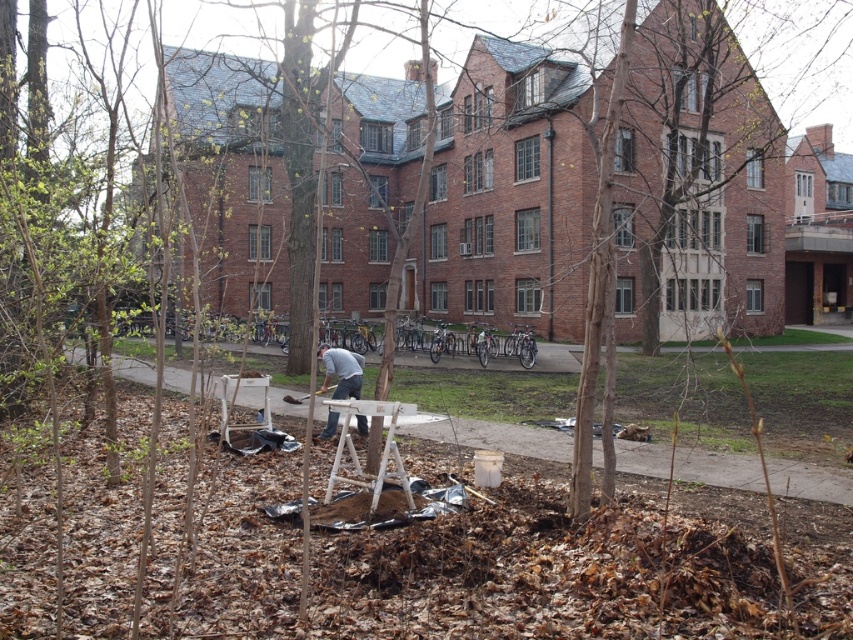
You are an artist who wants to set up your canvas on the white wood easel at center. However, there is a gray fabric at center in the way. Can you place the canvas on the easel without moving the fabric?

The white wood easel at center is taller than the gray fabric at center, so you can place the canvas on the easel without moving the fabric because the easel is higher.

You are a gardener who wants to place a new potted plant between the white wood easel at center and the gray fabric at center. Based on their positions, which object should the plant be closer to?

The white wood easel at center is to the right of the gray fabric at center, so the plant should be placed closer to the gray fabric at center to be between them.

You are an artist who wants to set up your painting equipment. You have a white wood easel at center and a gray fabric at center. Which object should you place first to ensure proper setup?

The gray fabric at center should be placed first because the white wood easel at center is located above it, so you need to position the gray fabric at center first to place the easel on top.